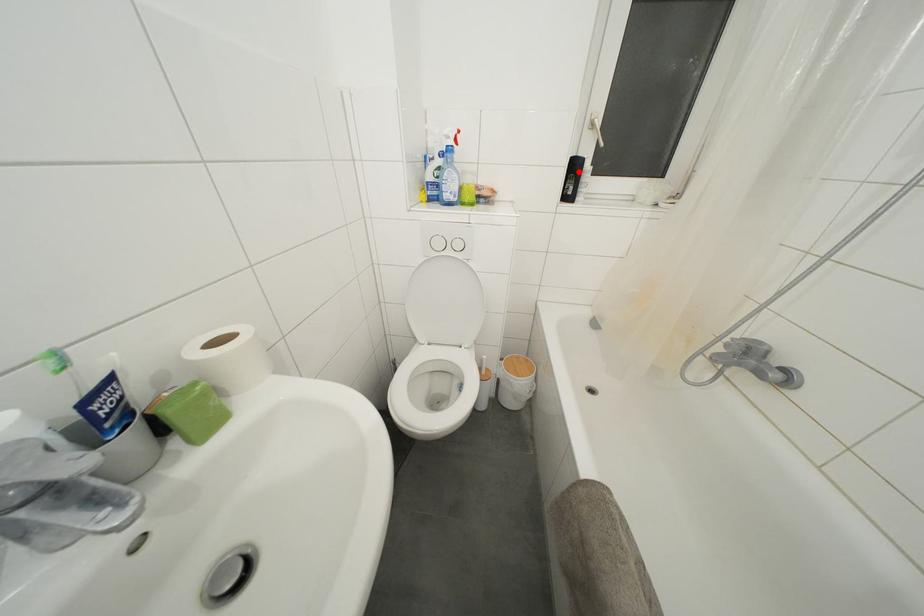
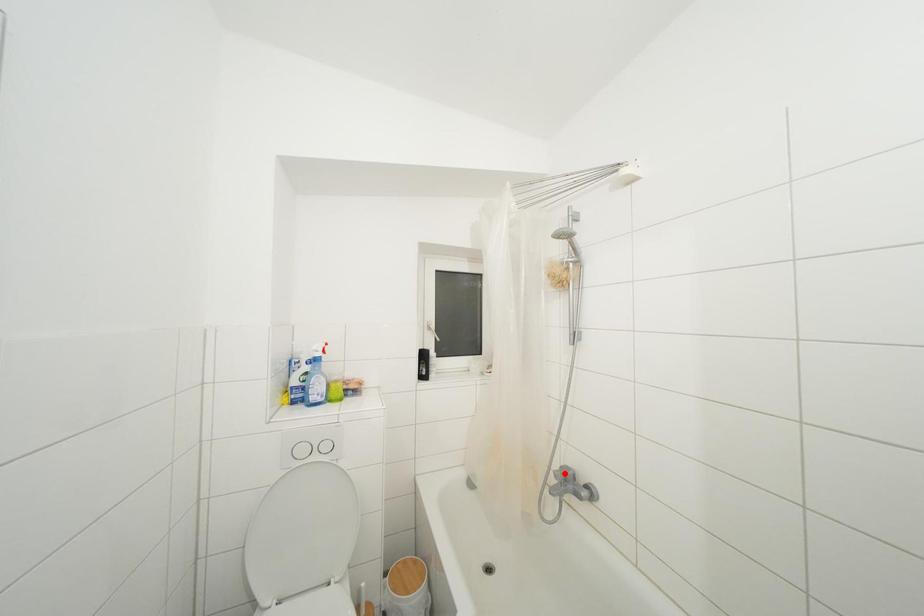
I am providing you with two images of the same scene from different viewpoints. A red point is marked on the first image and another point is marked on the second image. Are the points marked in image1 and image2 representing the same 3D position?

No